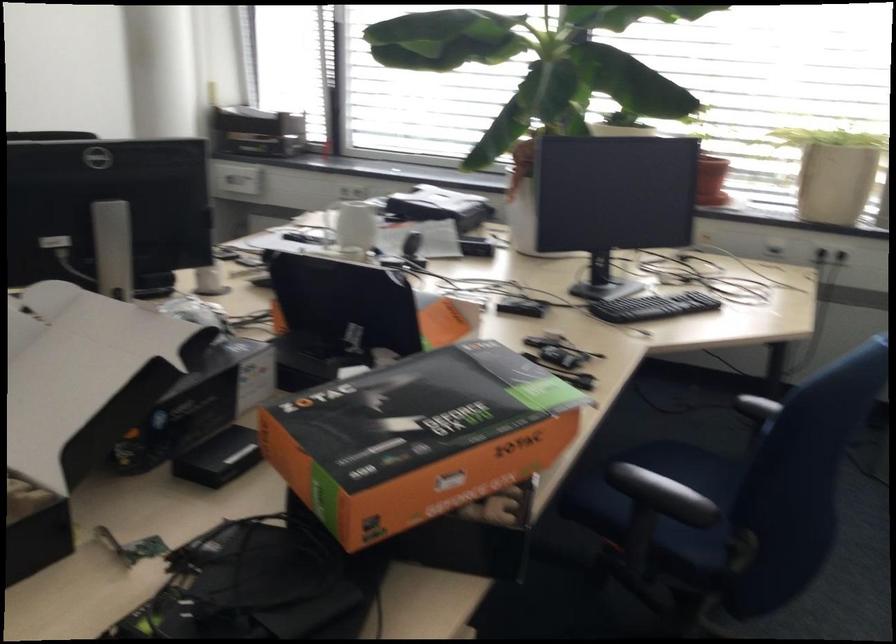
Identify the location of black chair armrest. The height and width of the screenshot is (644, 896). (661, 494).